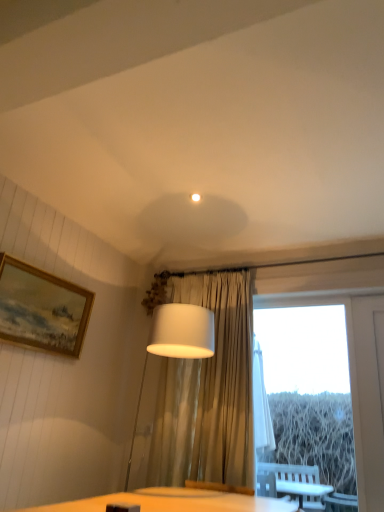
Locate an element on the screen. Image resolution: width=384 pixels, height=512 pixels. white fabric lampshade at center is located at coordinates (177, 342).

From a real-world perspective, is transparent glass window at center on gold-framed painting at upper left?

No, from a real-world perspective, transparent glass window at center is not on top of gold-framed painting at upper left.

Considering the relative sizes of transparent glass window at center and gold-framed painting at upper left in the image provided, is transparent glass window at center wider than gold-framed painting at upper left?

Incorrect, the width of transparent glass window at center does not surpass that of gold-framed painting at upper left.

Can you confirm if transparent glass window at center is bigger than gold-framed painting at upper left?

Incorrect, transparent glass window at center is not larger than gold-framed painting at upper left.

Is transparent glass window at center completely or partially inside white fabric lampshade at center?

No, transparent glass window at center is not a part of white fabric lampshade at center.

Is white fabric lampshade at center oriented towards transparent glass window at center?

No, white fabric lampshade at center does not turn towards transparent glass window at center.

Looking at this image, does white fabric lampshade at center touch transparent glass window at center?

No, white fabric lampshade at center is not with transparent glass window at center.

Between white fabric lampshade at center and gold-framed painting at upper left, which one appears on the right side from the viewer's perspective?

From the viewer's perspective, white fabric lampshade at center appears more on the right side.

From the image's perspective, is white fabric lampshade at center beneath gold-framed painting at upper left?

Yes.

Considering the points (200, 310) and (42, 298), which point is in front, point (200, 310) or point (42, 298)?

The point (200, 310) is closer.

Would you say gold-framed painting at upper left is to the left or to the right of white fabric lampshade at center in the picture?

From the image, it's evident that gold-framed painting at upper left is to the left of white fabric lampshade at center.

Consider the image. Does gold-framed painting at upper left touch white fabric lampshade at center?

No.

Does point (16, 264) appear closer or farther from the camera than point (189, 313)?

Point (16, 264) is positioned farther from the camera compared to point (189, 313).

Is gold-framed painting at upper left positioned with its back to white fabric lampshade at center?

No, gold-framed painting at upper left is not facing away from white fabric lampshade at center.

From the picture: Who is shorter, gold-framed painting at upper left or transparent glass window at center?

Standing shorter between the two is gold-framed painting at upper left.

Which object is further away from the camera taking this photo, gold-framed painting at upper left or transparent glass window at center?

Positioned behind is transparent glass window at center.

Which object is positioned more to the right, gold-framed painting at upper left or transparent glass window at center?

Positioned to the right is transparent glass window at center.

From the image's perspective, is gold-framed painting at upper left located above or below transparent glass window at center?

gold-framed painting at upper left is situated higher than transparent glass window at center in the image.

Does point (305, 326) come farther from viewer compared to point (163, 356)?

Yes, point (305, 326) is behind point (163, 356).

I want to click on window above the white fabric lampshade at center (from a real-world perspective), so click(311, 384).

Considering the sizes of objects transparent glass window at center and white fabric lampshade at center in the image provided, who is bigger, transparent glass window at center or white fabric lampshade at center?

white fabric lampshade at center is bigger.

From the image's perspective, between transparent glass window at center and white fabric lampshade at center, who is located below?

transparent glass window at center, from the image's perspective.

At what (x,y) coordinates should I click in order to perform the action: click on window behind the gold-framed painting at upper left. Please return your answer as a coordinate pair (x, y). The image size is (384, 512). Looking at the image, I should click on (311, 384).

You are a GUI agent. You are given a task and a screenshot of the screen. Output one action in this format:
    pyautogui.click(x=<x>, y=<y>)
    Task: Click on the table lamp above the transparent glass window at center (from the image's perspective)
    The height and width of the screenshot is (512, 384).
    Given the screenshot: What is the action you would take?
    pyautogui.click(x=177, y=342)

From the picture: Looking at the image, which one is located closer to white fabric lampshade at center, transparent glass window at center or gold-framed painting at upper left?

Among the two, gold-framed painting at upper left is located nearer to white fabric lampshade at center.

Considering their positions, is transparent glass window at center positioned closer to gold-framed painting at upper left than white fabric lampshade at center?

white fabric lampshade at center is closer to gold-framed painting at upper left.

Considering their positions, is white fabric lampshade at center positioned further to gold-framed painting at upper left than transparent glass window at center?

transparent glass window at center is further to gold-framed painting at upper left.

From the image, which object appears to be nearer to transparent glass window at center, gold-framed painting at upper left or white fabric lampshade at center?

The object closer to transparent glass window at center is white fabric lampshade at center.

Estimate the real-world distances between objects in this image. Which object is closer to transparent glass window at center, white fabric lampshade at center or gold-framed painting at upper left?

Based on the image, white fabric lampshade at center appears to be nearer to transparent glass window at center.

Based on their spatial positions, is gold-framed painting at upper left or transparent glass window at center closer to white fabric lampshade at center?

gold-framed painting at upper left.

Identify the location of table lamp between gold-framed painting at upper left and transparent glass window at center from left to right. click(177, 342).